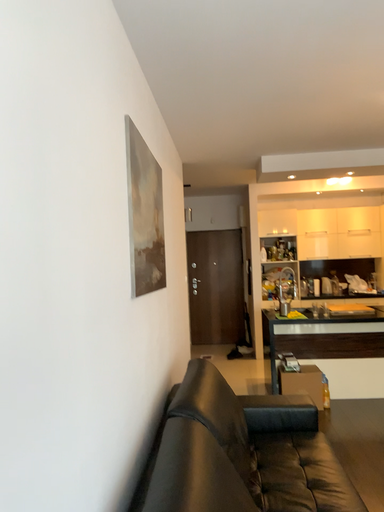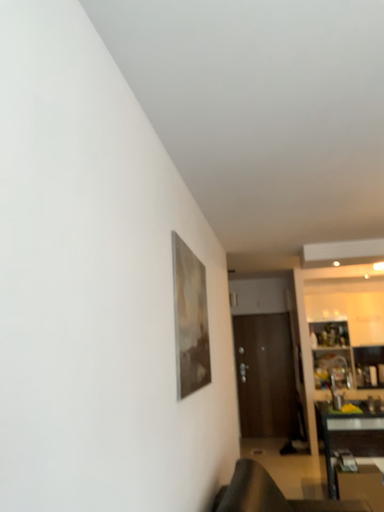
Question: How did the camera likely rotate when shooting the video?

Choices:
 (A) rotated left
 (B) rotated right

Answer: (A)